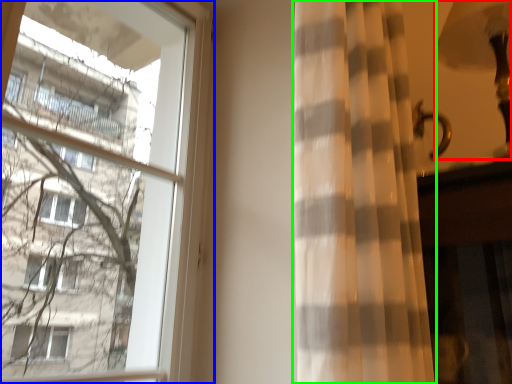
Question: Estimate the real-world distances between objects in this image. Which object is farther from table lamp (highlighted by a red box), window (highlighted by a blue box) or curtain (highlighted by a green box)?

Choices:
 (A) window
 (B) curtain

Answer: (A)